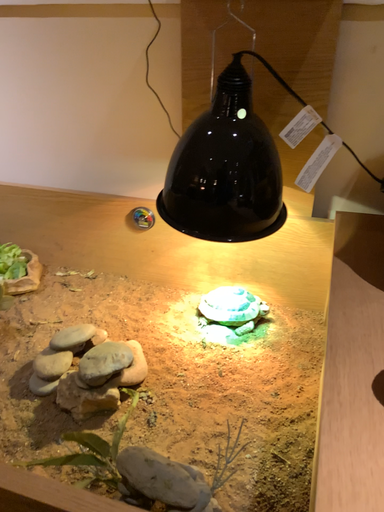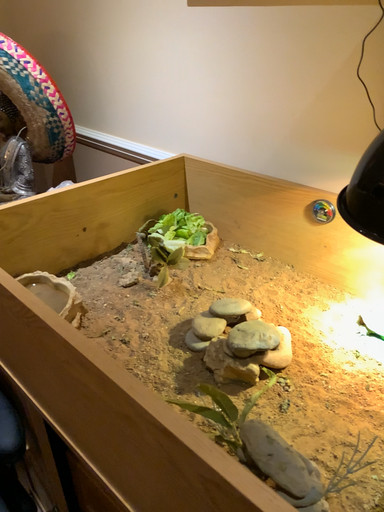
Question: Which way did the camera rotate in the video?

Choices:
 (A) rotated right
 (B) rotated left

Answer: (B)